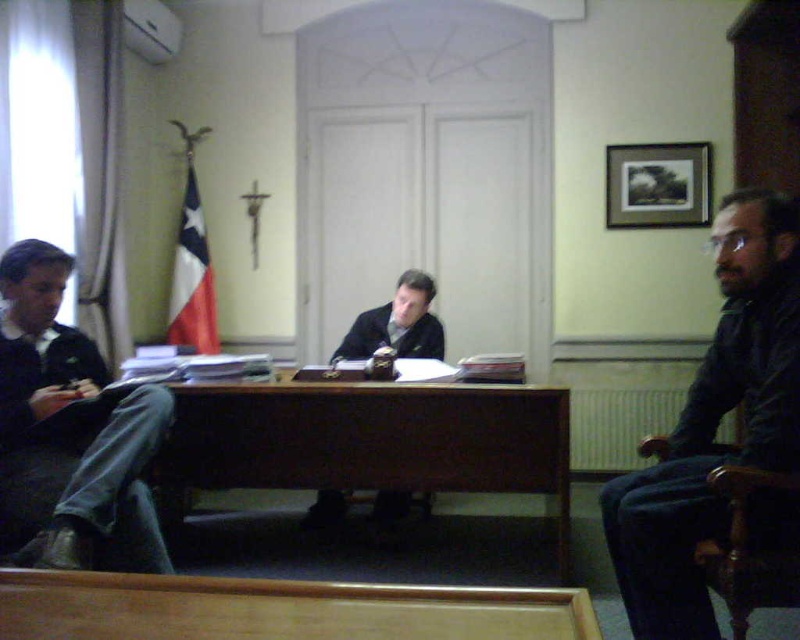
Does dark blue shirt at right appear over dark blue jeans at left?

Correct, dark blue shirt at right is located above dark blue jeans at left.

Is dark blue shirt at right to the right of dark blue jeans at left from the viewer's perspective?

Correct, you'll find dark blue shirt at right to the right of dark blue jeans at left.

Where is `dark blue shirt at right`? This screenshot has width=800, height=640. dark blue shirt at right is located at coordinates (714, 422).

Can you confirm if dark blue jeans at left is shorter than dark brown leather shoes at center?

No, dark blue jeans at left is not shorter than dark brown leather shoes at center.

Between point (88, 550) and point (384, 305), which one is positioned behind?

The point (384, 305) is behind.

Find the location of a particular element. Image resolution: width=800 pixels, height=640 pixels. dark blue jeans at left is located at coordinates (72, 428).

Is point (729, 298) farther from viewer compared to point (400, 324)?

That is False.

Can you confirm if dark blue shirt at right is positioned to the left of dark brown leather shoes at center?

In fact, dark blue shirt at right is to the right of dark brown leather shoes at center.

Is point (798, 440) closer to viewer compared to point (406, 508)?

That is True.

Locate an element on the screen. dark blue shirt at right is located at coordinates (714, 422).